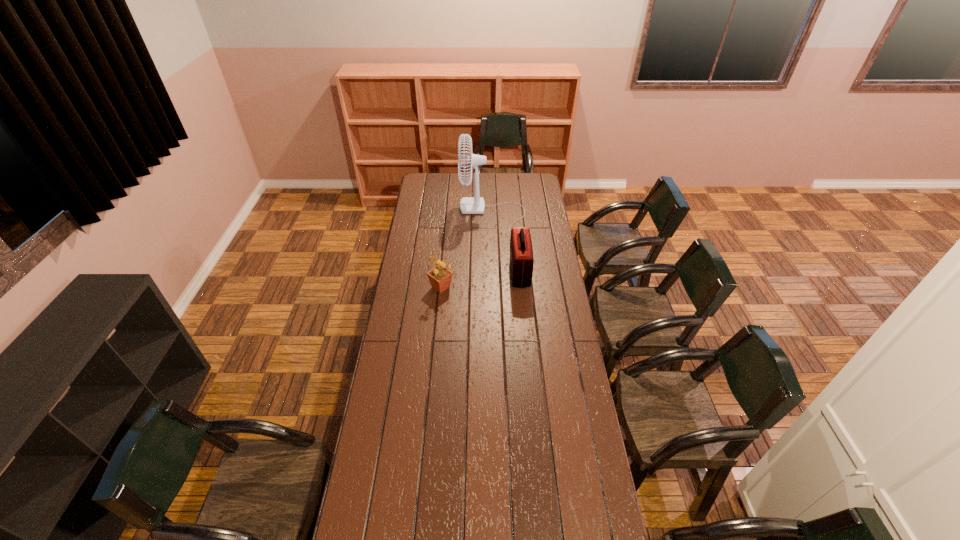
Where is `the tallest object`? Image resolution: width=960 pixels, height=540 pixels. the tallest object is located at coordinates (468, 205).

In order to click on the farthest object in this screenshot , I will do `click(468, 205)`.

Locate an element on the screen. The width and height of the screenshot is (960, 540). the first aid kit is located at coordinates (521, 252).

At what (x,y) coordinates should I click in order to perform the action: click on sunflower. Please return your answer as a coordinate pair (x, y). The width and height of the screenshot is (960, 540). Looking at the image, I should click on (440, 277).

The width and height of the screenshot is (960, 540). I want to click on vacant region located on the front-facing side of the fan, so click(x=423, y=214).

The height and width of the screenshot is (540, 960). I want to click on vacant region located on the front-facing side of the fan, so click(x=434, y=214).

Where is `vacant space located on the front-facing side of the fan`? vacant space located on the front-facing side of the fan is located at coordinates (435, 214).

You are a GUI agent. You are given a task and a screenshot of the screen. Output one action in this format:
    pyautogui.click(x=<x>, y=<y>)
    Task: Click on the vacant position located on the side of the first aid kit with the cross symbol
    
    Given the screenshot: What is the action you would take?
    pyautogui.click(x=444, y=272)

Find the location of `free space located on the side of the first aid kit with the cross symbol`. free space located on the side of the first aid kit with the cross symbol is located at coordinates (437, 272).

Locate an element on the screen. free space located 0.200m on the side of the first aid kit with the cross symbol is located at coordinates coord(470,272).